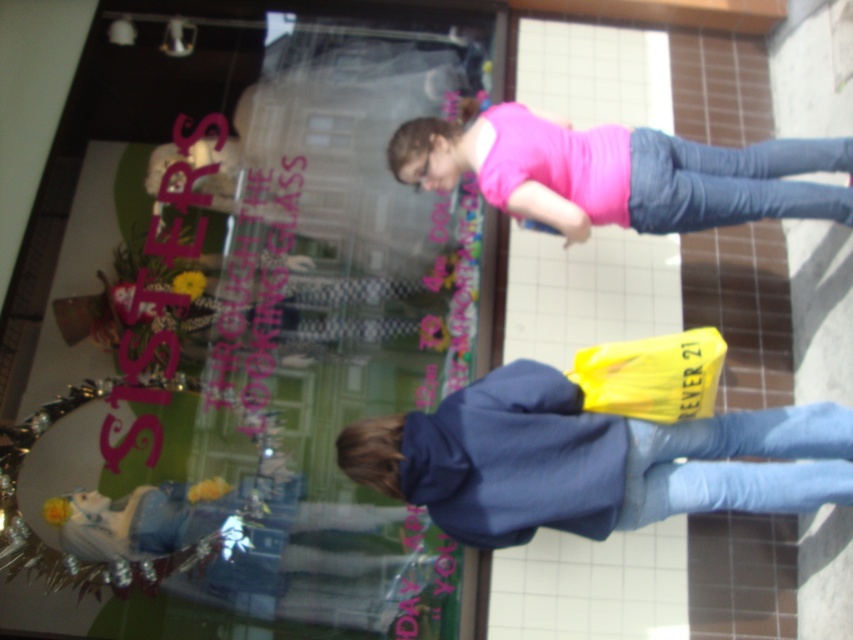
In the scene shown: You are a customer looking at the window display for Sisters Through the Looking Glass. You see two pairs of denim jeans at lower right and denim jeans at center. Which pair is positioned more to the left side of the display?

The denim jeans at lower right is positioned more to the left side of the display than the denim jeans at center.